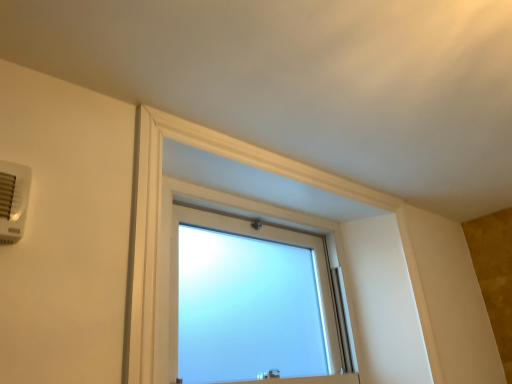
Question: Is frosted glass window at upper center to the left of frosted glass window at center from the viewer's perspective?

Choices:
 (A) no
 (B) yes

Answer: (A)

Question: Is frosted glass window at upper center shorter than frosted glass window at center?

Choices:
 (A) no
 (B) yes

Answer: (A)

Question: Does frosted glass window at upper center appear on the right side of frosted glass window at center?

Choices:
 (A) no
 (B) yes

Answer: (B)

Question: Is frosted glass window at upper center facing away from frosted glass window at center?

Choices:
 (A) yes
 (B) no

Answer: (A)

Question: Can you confirm if frosted glass window at upper center is thinner than frosted glass window at center?

Choices:
 (A) no
 (B) yes

Answer: (B)

Question: Considering the positions of frosted glass window at upper center and white plastic air conditioning unit at upper left in the image, is frosted glass window at upper center wider or thinner than white plastic air conditioning unit at upper left?

Choices:
 (A) thin
 (B) wide

Answer: (A)

Question: From a real-world perspective, is frosted glass window at upper center positioned above or below white plastic air conditioning unit at upper left?

Choices:
 (A) below
 (B) above

Answer: (A)

Question: Considering their positions, is frosted glass window at upper center located in front of or behind white plastic air conditioning unit at upper left?

Choices:
 (A) behind
 (B) front

Answer: (A)

Question: Considering the positions of point (148, 124) and point (22, 190), is point (148, 124) closer or farther from the camera than point (22, 190)?

Choices:
 (A) closer
 (B) farther

Answer: (B)

Question: In terms of height, does frosted glass window at upper center look taller or shorter compared to frosted glass window at center?

Choices:
 (A) short
 (B) tall

Answer: (B)

Question: Is point (137, 292) closer or farther from the camera than point (318, 347)?

Choices:
 (A) closer
 (B) farther

Answer: (A)

Question: Looking at their shapes, would you say frosted glass window at upper center is wider or thinner than frosted glass window at center?

Choices:
 (A) wide
 (B) thin

Answer: (B)

Question: Is frosted glass window at upper center spatially inside frosted glass window at center, or outside of it?

Choices:
 (A) outside
 (B) inside

Answer: (A)

Question: Is white plastic air conditioning unit at upper left in front of or behind frosted glass window at center in the image?

Choices:
 (A) front
 (B) behind

Answer: (A)

Question: Is point (7, 230) positioned closer to the camera than point (306, 374)?

Choices:
 (A) farther
 (B) closer

Answer: (B)